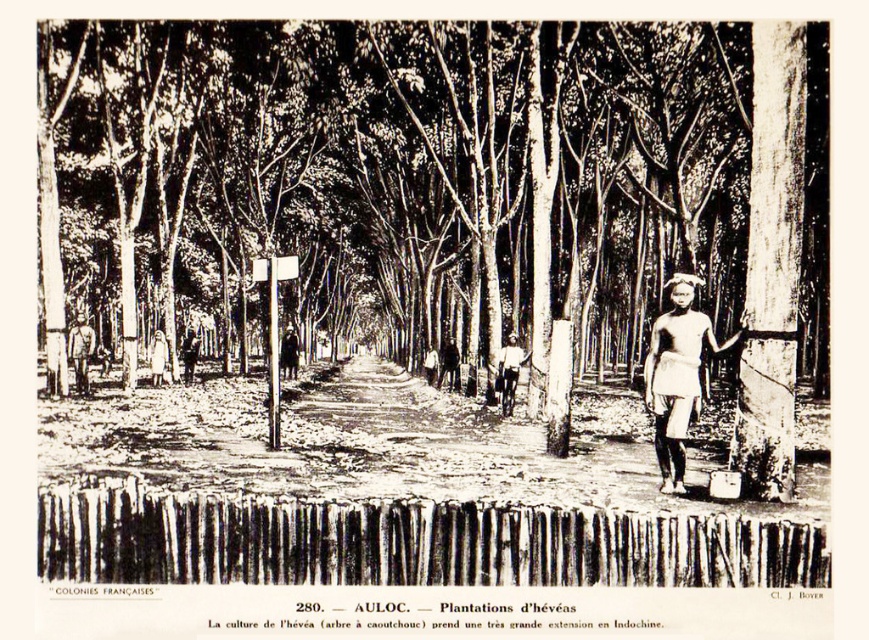
Is smooth bark tree at center thinner than white cotton shirt at center?

Incorrect, smooth bark tree at center's width is not less than white cotton shirt at center's.

Is smooth bark tree at center wider than white cotton shirt at center?

Yes.

The image size is (869, 640). Describe the element at coordinates (433, 176) in the screenshot. I see `smooth bark tree at center` at that location.

At what (x,y) coordinates should I click in order to perform the action: click on smooth bark tree at center. Please return your answer as a coordinate pair (x, y). Looking at the image, I should click on (433, 176).

Which is in front, point (507, 412) or point (90, 332)?

Point (507, 412)

Is white cotton shirt at center to the left of light brown wooden post at left from the viewer's perspective?

In fact, white cotton shirt at center is to the right of light brown wooden post at left.

Is point (509, 406) positioned behind point (80, 388)?

That is False.

Locate an element on the screen. white cotton shirt at center is located at coordinates (509, 371).

Is smooth bark tree at center taller than light brown wooden post at left?

Correct, smooth bark tree at center is much taller as light brown wooden post at left.

Measure the distance between point [429,307] and camera.

Point [429,307] is 34.14 meters from camera.

What are the coordinates of `smooth bark tree at center` in the screenshot? It's located at (433, 176).